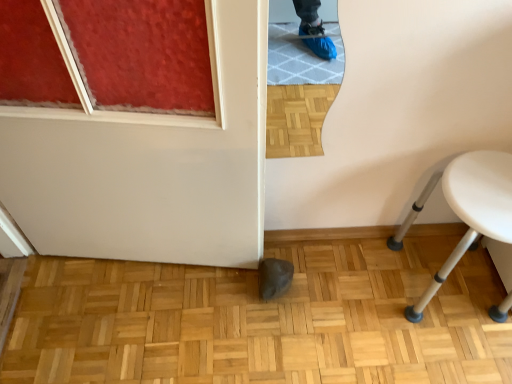
Question: Does white plastic stool at lower right appear on the left side of natural wood parquet floor at center?

Choices:
 (A) yes
 (B) no

Answer: (B)

Question: Is white plastic stool at lower right completely or partially outside of natural wood parquet floor at center?

Choices:
 (A) no
 (B) yes

Answer: (B)

Question: From a real-world perspective, is white plastic stool at lower right physically below natural wood parquet floor at center?

Choices:
 (A) no
 (B) yes

Answer: (A)

Question: Are white plastic stool at lower right and natural wood parquet floor at center located far from each other?

Choices:
 (A) no
 (B) yes

Answer: (A)

Question: From the image's perspective, would you say white plastic stool at lower right is shown under natural wood parquet floor at center?

Choices:
 (A) yes
 (B) no

Answer: (B)

Question: Can natural wood parquet floor at center be found inside white plastic stool at lower right?

Choices:
 (A) no
 (B) yes

Answer: (A)

Question: Does natural wood parquet floor at center have a lesser width compared to white plastic stool at lower right?

Choices:
 (A) no
 (B) yes

Answer: (A)

Question: From the image's perspective, does natural wood parquet floor at center appear lower than white plastic stool at lower right?

Choices:
 (A) no
 (B) yes

Answer: (B)

Question: Is natural wood parquet floor at center beside white plastic stool at lower right?

Choices:
 (A) no
 (B) yes

Answer: (A)

Question: Is natural wood parquet floor at center far away from white plastic stool at lower right?

Choices:
 (A) yes
 (B) no

Answer: (B)

Question: Considering the relative positions of natural wood parquet floor at center and white plastic stool at lower right in the image provided, is natural wood parquet floor at center to the right of white plastic stool at lower right from the viewer's perspective?

Choices:
 (A) no
 (B) yes

Answer: (A)

Question: From the image's perspective, is natural wood parquet floor at center located above white plastic stool at lower right?

Choices:
 (A) no
 (B) yes

Answer: (A)

Question: Does natural wood parquet floor at center have a greater height compared to white glossy door at lower center?

Choices:
 (A) no
 (B) yes

Answer: (A)